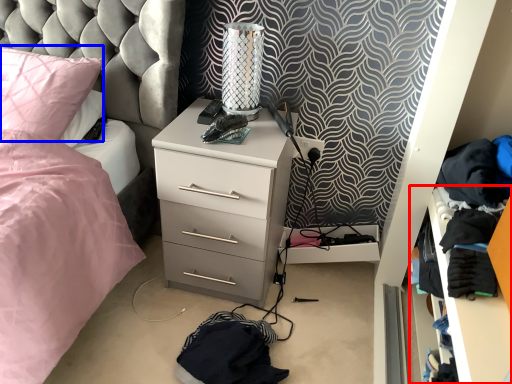
Question: Which object is further to the camera taking this photo, shelf (highlighted by a red box) or pillow (highlighted by a blue box)?

Choices:
 (A) shelf
 (B) pillow

Answer: (B)